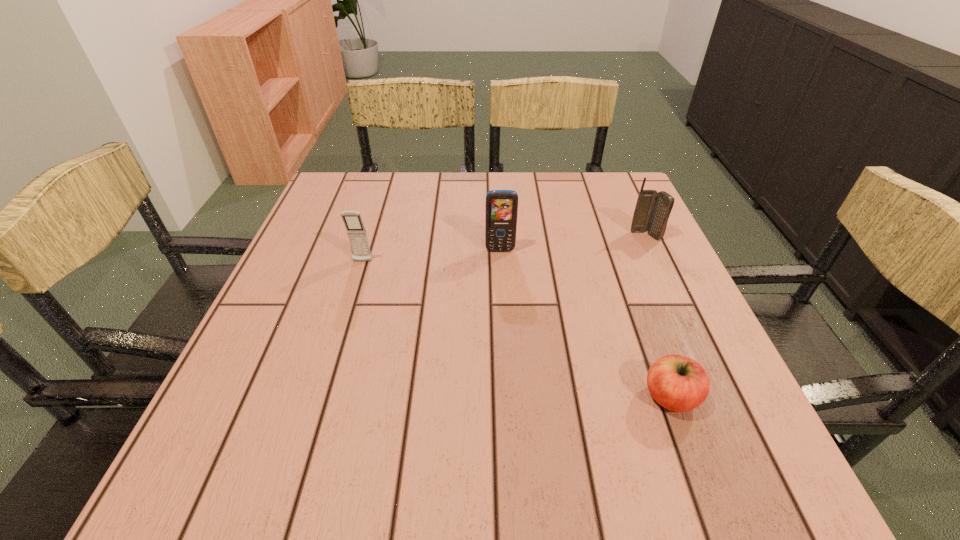
This screenshot has height=540, width=960. Find the location of `vacant area between the rightmost object and the third object from right to left`. vacant area between the rightmost object and the third object from right to left is located at coordinates (573, 243).

This screenshot has height=540, width=960. Identify the location of object that is the nearest to the second farthest cellular telephone. (356, 231).

Locate which object is the third closest to the apple. Please provide its 2D coordinates. Your answer should be formatted as a tuple, i.e. [(x, y)], where the tuple contains the x and y coordinates of a point satisfying the conditions above.

[(356, 231)]

The image size is (960, 540). I want to click on cellular telephone that is the closest to the second farthest cellular telephone, so click(356, 231).

Identify which cellular telephone is the nearest to the second nearest cellular telephone. Please provide its 2D coordinates. Your answer should be formatted as a tuple, i.e. [(x, y)], where the tuple contains the x and y coordinates of a point satisfying the conditions above.

[(356, 231)]

Where is `free point that satisfies the following two spatial constraints: 1. on the screen of the second farthest object; 2. on the left side of the nearest object`? This screenshot has width=960, height=540. free point that satisfies the following two spatial constraints: 1. on the screen of the second farthest object; 2. on the left side of the nearest object is located at coordinates (508, 397).

Image resolution: width=960 pixels, height=540 pixels. I want to click on vacant region that satisfies the following two spatial constraints: 1. on the front-facing side of the second nearest object; 2. on the right side of the nearest object, so click(321, 397).

I want to click on free space that satisfies the following two spatial constraints: 1. on the screen of the nearest object; 2. on the left side of the third object from right to left, so click(508, 397).

In order to click on vacant space that satisfies the following two spatial constraints: 1. on the screen of the second object from right to left; 2. on the right side of the second object from left to right in this screenshot , I will do `click(508, 397)`.

Locate an element on the screen. blank space that satisfies the following two spatial constraints: 1. on the front-facing side of the apple; 2. on the left side of the leftmost cellular telephone is located at coordinates (321, 397).